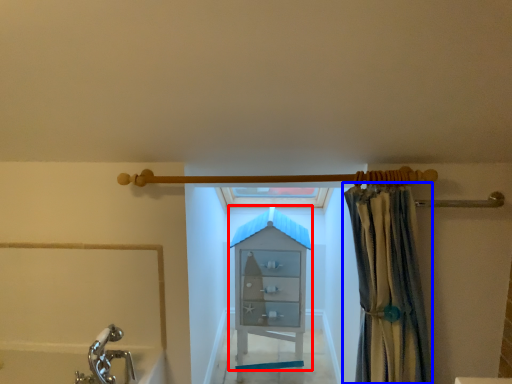
Question: Which point is closer to the camera, cabinet (highlighted by a red box) or curtain (highlighted by a blue box)?

Choices:
 (A) cabinet
 (B) curtain

Answer: (B)